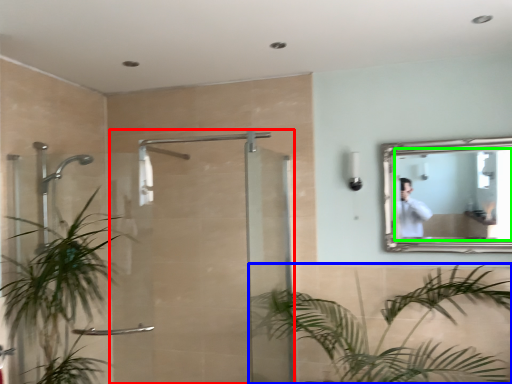
Question: Considering the real-world distances, which object is closest to screen door (highlighted by a red box)? houseplant (highlighted by a blue box) or mirror (highlighted by a green box).

Choices:
 (A) houseplant
 (B) mirror

Answer: (A)